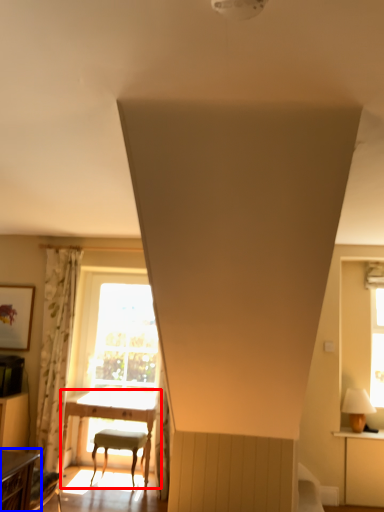
Question: Which object is closer to the camera taking this photo, table (highlighted by a red box) or table (highlighted by a blue box)?

Choices:
 (A) table
 (B) table

Answer: (B)